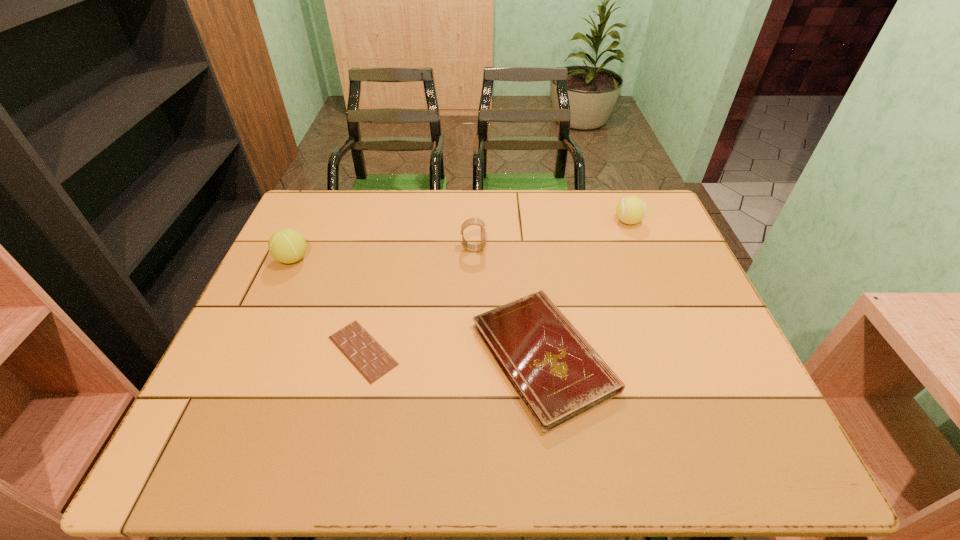
In order to click on vacant space situated on the front of the farther tennis ball in this screenshot , I will do `click(642, 256)`.

You are a GUI agent. You are given a task and a screenshot of the screen. Output one action in this format:
    pyautogui.click(x=<x>, y=<y>)
    Task: Click on the blank space located 0.250m on the left of the notebook
    This screenshot has width=960, height=540.
    Given the screenshot: What is the action you would take?
    pyautogui.click(x=362, y=356)

Where is `vacant space located 0.300m on the back of the shortest object`? vacant space located 0.300m on the back of the shortest object is located at coordinates (388, 242).

Image resolution: width=960 pixels, height=540 pixels. I want to click on object present at the far edge, so click(630, 210).

The height and width of the screenshot is (540, 960). I want to click on object located in the near edge section of the desktop, so click(x=556, y=373).

Where is `object that is at the left edge`? object that is at the left edge is located at coordinates (286, 245).

Where is `object that is at the right edge`? Image resolution: width=960 pixels, height=540 pixels. object that is at the right edge is located at coordinates (630, 210).

Where is `object situated at the far right corner`? The image size is (960, 540). object situated at the far right corner is located at coordinates (630, 210).

Find the location of a particular element. This screenshot has height=540, width=960. free space at the far edge is located at coordinates (582, 202).

Where is `free space at the left edge of the desktop`? free space at the left edge of the desktop is located at coordinates tap(283, 318).